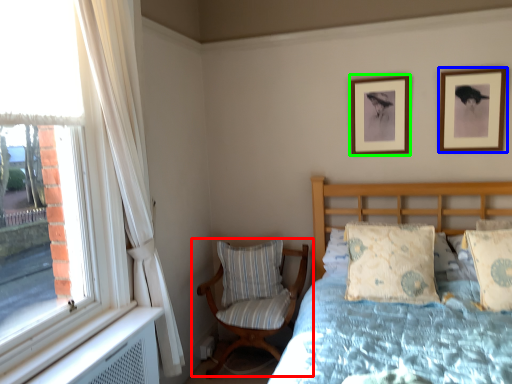
Question: Which object is positioned closest to chair (highlighted by a red box)? Select from picture frame (highlighted by a blue box) and picture frame (highlighted by a green box).

Choices:
 (A) picture frame
 (B) picture frame

Answer: (B)